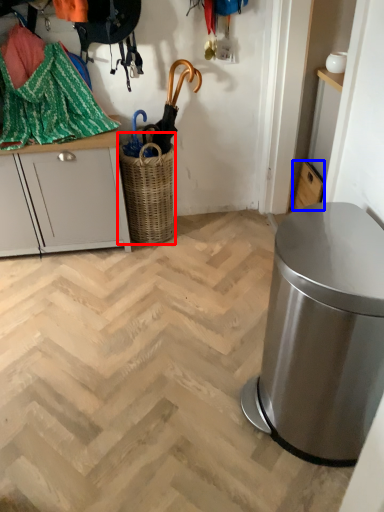
Question: Which point is closer to the camera, basket (highlighted by a red box) or cabinetry (highlighted by a blue box)?

Choices:
 (A) basket
 (B) cabinetry

Answer: (A)